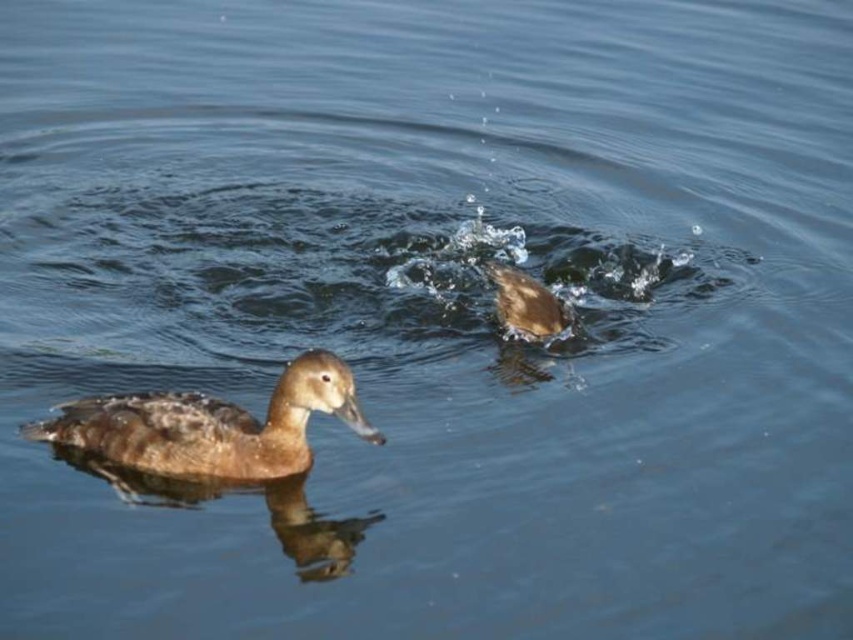
Question: Which object appears farthest from the camera in this image?

Choices:
 (A) brown fuzzy duck at lower left
 (B) brown fuzzy duck at center

Answer: (B)

Question: Does brown fuzzy duck at lower left appear over brown fuzzy duck at center?

Choices:
 (A) yes
 (B) no

Answer: (B)

Question: Is brown fuzzy duck at lower left positioned at the back of brown fuzzy duck at center?

Choices:
 (A) yes
 (B) no

Answer: (B)

Question: Is brown fuzzy duck at lower left positioned behind brown fuzzy duck at center?

Choices:
 (A) no
 (B) yes

Answer: (A)